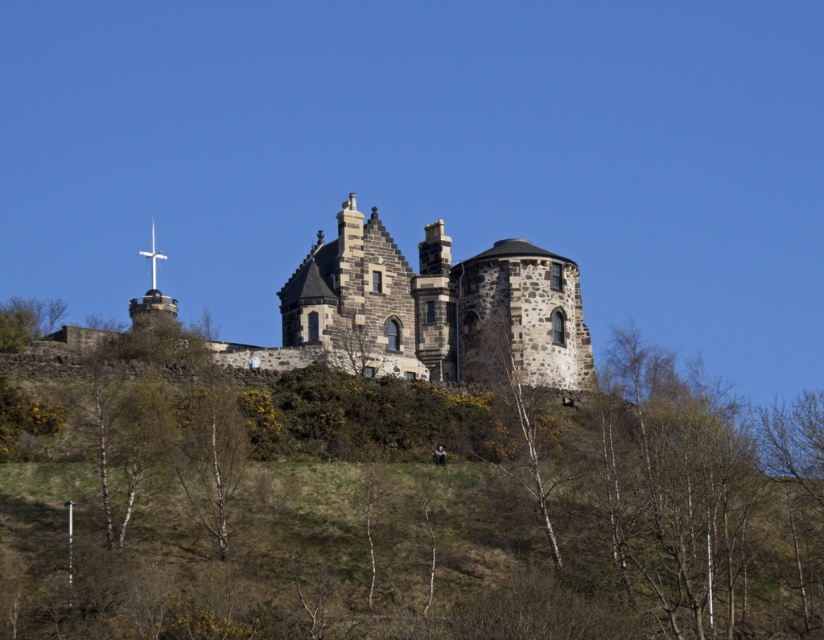
Is smooth white birch at lower center thinner than bare wood tree at center?

Indeed, smooth white birch at lower center has a lesser width compared to bare wood tree at center.

Based on the photo, which is above, smooth white birch at lower center or bare wood tree at center?

smooth white birch at lower center is higher up.

Who is more distant from viewer, (x=216, y=456) or (x=501, y=408)?

Point (x=501, y=408)

You are a GUI agent. You are given a task and a screenshot of the screen. Output one action in this format:
    pyautogui.click(x=<x>, y=<y>)
    Task: Click on the smooth white birch at lower center
    Image resolution: width=824 pixels, height=640 pixels.
    Given the screenshot: What is the action you would take?
    pyautogui.click(x=209, y=456)

Is point (659, 579) positioned before point (144, 253)?

That is True.

Is point (640, 468) behind point (152, 257)?

No, it is not.

Locate an element on the screen. This screenshot has width=824, height=640. green leafy tree at center is located at coordinates (417, 512).

Does dark gray stone castle at center appear on the right side of smooth white birch at lower center?

Yes, dark gray stone castle at center is to the right of smooth white birch at lower center.

Between point (429, 304) and point (214, 538), which one is positioned behind?

Positioned behind is point (429, 304).

The height and width of the screenshot is (640, 824). I want to click on dark gray stone castle at center, so pos(438,307).